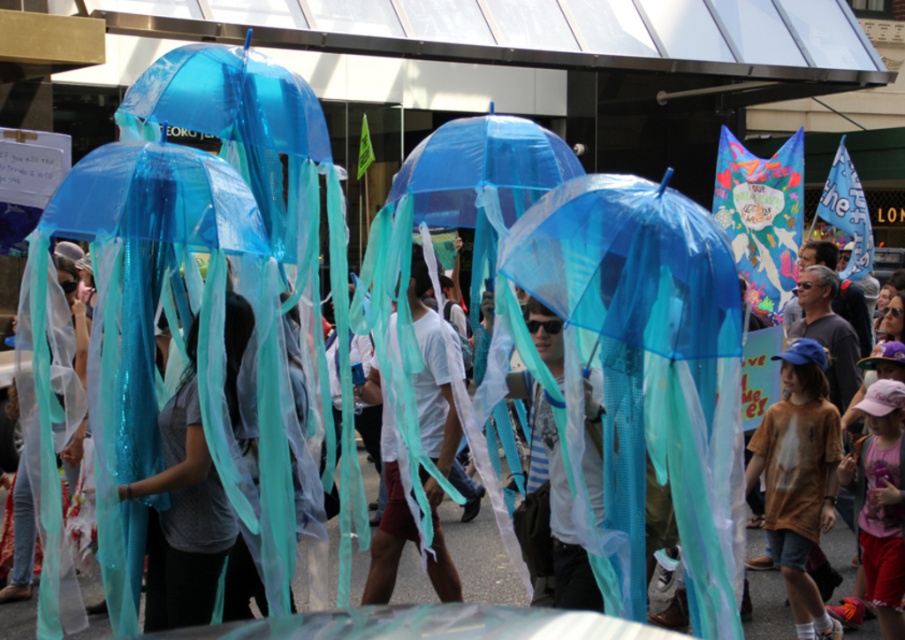
Question: Estimate the real-world distances between objects in this image. Which object is closer to the matte gray shirt at center?

Choices:
 (A) pink fabric hat at lower right
 (B) white matte t-shirt at center
 (C) matte blue umbrella at center

Answer: (C)

Question: Can you confirm if transparent plastic umbrella at center is smaller than pink fabric hat at lower right?

Choices:
 (A) yes
 (B) no

Answer: (B)

Question: Can you confirm if transparent plastic umbrella at center is positioned to the right of brown cotton shirt at center-right?

Choices:
 (A) yes
 (B) no

Answer: (B)

Question: Which point is closer to the camera?

Choices:
 (A) (808, 316)
 (B) (421, 288)
 (C) (218, 566)
 (D) (589, 410)

Answer: (D)

Question: Considering the real-world distances, which object is closest to the brown cotton shirt at center-right?

Choices:
 (A) matte gray shirt at center
 (B) brown cotton shirt at center
 (C) transparent plastic umbrella at center
 (D) white matte t-shirt at center

Answer: (B)

Question: Is matte blue umbrella at center positioned before brown cotton shirt at center?

Choices:
 (A) no
 (B) yes

Answer: (B)